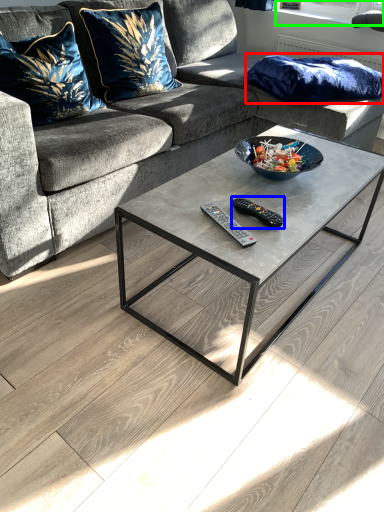
Question: Based on their relative distances, which object is nearer to pillow (highlighted by a red box)? Choose from remote (highlighted by a blue box) and window screen (highlighted by a green box).

Choices:
 (A) remote
 (B) window screen

Answer: (B)